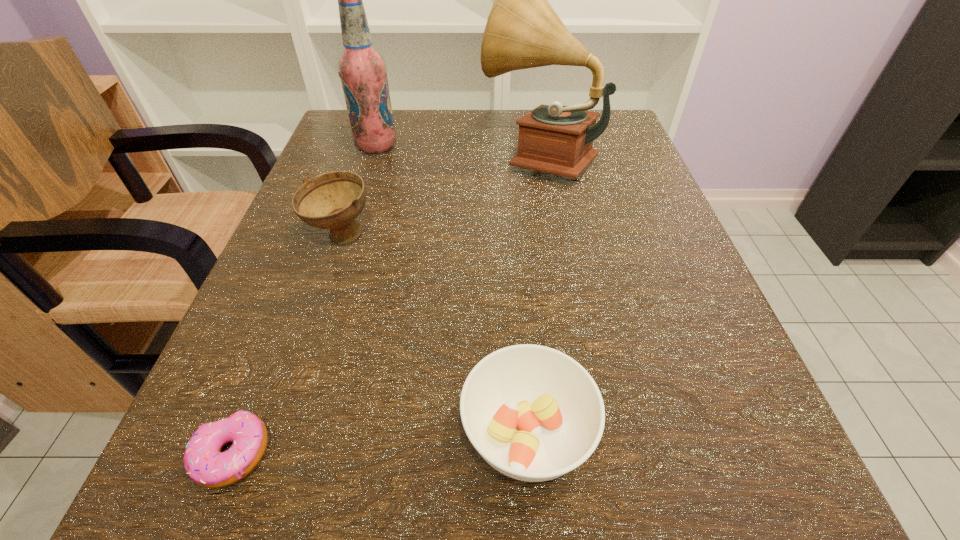
Find the location of a particular element. Image resolution: width=960 pixels, height=540 pixels. doughnut located in the left edge section of the desktop is located at coordinates (205, 464).

This screenshot has height=540, width=960. I want to click on object that is at the right edge, so click(x=523, y=31).

I want to click on object that is at the far left corner, so click(x=362, y=69).

This screenshot has height=540, width=960. Identify the location of object that is positioned at the near left corner. (205, 464).

You are a GUI agent. You are given a task and a screenshot of the screen. Output one action in this format:
    pyautogui.click(x=<x>, y=<y>)
    Task: Click on the object that is at the far right corner
    This screenshot has height=540, width=960.
    Given the screenshot: What is the action you would take?
    pyautogui.click(x=523, y=31)

Where is `free space at the far edge of the desktop`? Image resolution: width=960 pixels, height=540 pixels. free space at the far edge of the desktop is located at coordinates (507, 148).

In the image, there is a desktop. Identify the location of vacant space at the left edge. The height and width of the screenshot is (540, 960). (303, 258).

In the image, there is a desktop. Identify the location of vacant area at the right edge. The image size is (960, 540). (652, 265).

In the image, there is a desktop. At what (x,y) coordinates should I click in order to perform the action: click on vacant space at the far left corner. Please return your answer as a coordinate pair (x, y). The image size is (960, 540). Looking at the image, I should click on (357, 157).

Identify the location of vacant region at the far right corner of the desktop. The width and height of the screenshot is (960, 540). (596, 166).